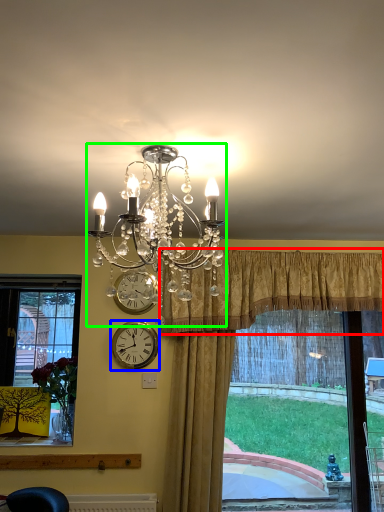
Question: Which is nearer to the curtain (highlighted by a red box)? wall clock (highlighted by a blue box) or lamp (highlighted by a green box).

Choices:
 (A) wall clock
 (B) lamp

Answer: (A)